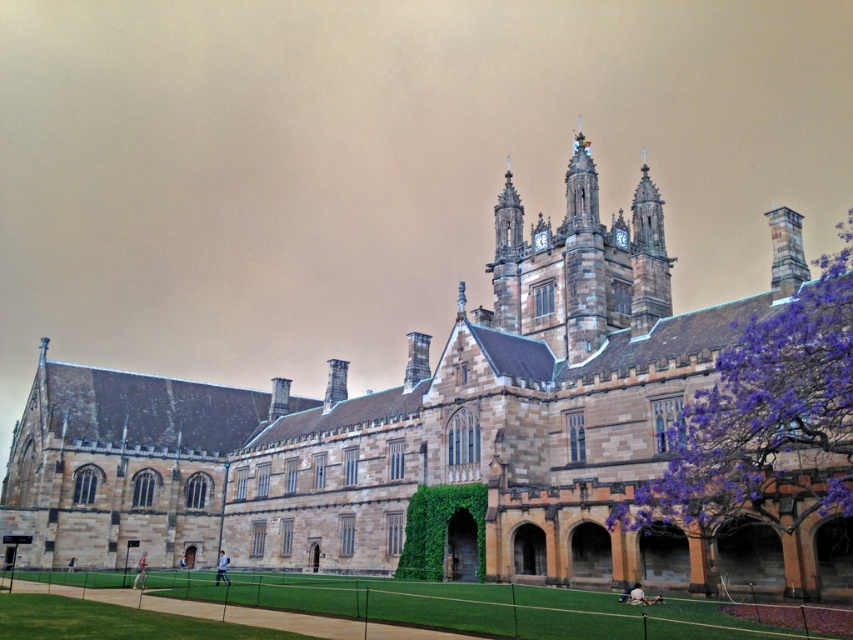
Who is higher up, purple wood tree at right or brown stone clock tower at upper center?

purple wood tree at right

This screenshot has width=853, height=640. What are the coordinates of `purple wood tree at right` in the screenshot? It's located at (764, 420).

You are a GUI agent. You are given a task and a screenshot of the screen. Output one action in this format:
    pyautogui.click(x=<x>, y=<y>)
    Task: Click on the purple wood tree at right
    Image resolution: width=853 pixels, height=640 pixels.
    Given the screenshot: What is the action you would take?
    pyautogui.click(x=764, y=420)